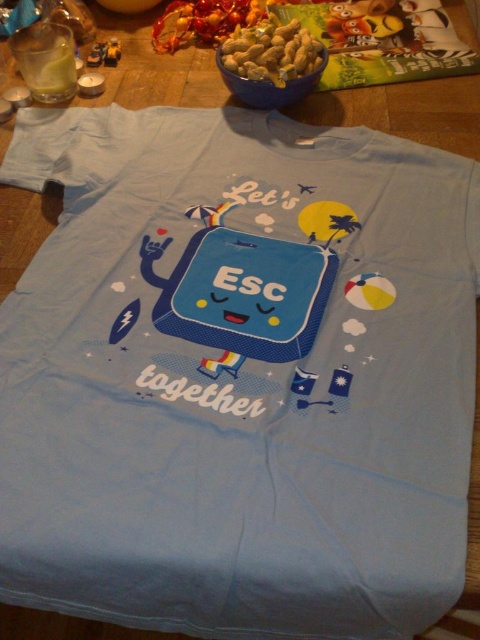
Is point (238, 26) less distant than point (108, 44)?

Yes, point (238, 26) is in front of point (108, 44).

Can you confirm if shiny plastic toy at upper center is smaller than yellow plastic toy at upper left?

No.

Between point (168, 20) and point (106, 51), which one is positioned behind?

The point (168, 20) is behind.

The image size is (480, 640). Find the location of `shiny plastic toy at upper center`. shiny plastic toy at upper center is located at coordinates (204, 20).

Which is below, smooth brown cereal at upper center or yellow plastic toy at upper left?

smooth brown cereal at upper center

Is smooth brown cereal at upper center positioned in front of yellow plastic toy at upper left?

Yes.

Between point (272, 16) and point (117, 58), which one is positioned in front?

Positioned in front is point (117, 58).

Where is `smooth brown cereal at upper center`? The height and width of the screenshot is (640, 480). smooth brown cereal at upper center is located at coordinates (271, 52).

Between smooth brown cereal at upper center and cartoonish plastic toy at upper center, which one is positioned higher?

cartoonish plastic toy at upper center is above.

Does smooth brown cereal at upper center have a greater height compared to cartoonish plastic toy at upper center?

Yes.

Which is behind, point (264, 58) or point (355, 1)?

Positioned behind is point (355, 1).

I want to click on smooth brown cereal at upper center, so click(x=271, y=52).